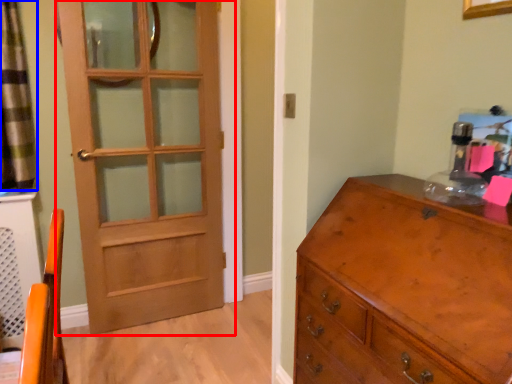
Question: Which object appears farthest to the camera in this image, door (highlighted by a red box) or curtain (highlighted by a blue box)?

Choices:
 (A) door
 (B) curtain

Answer: (A)